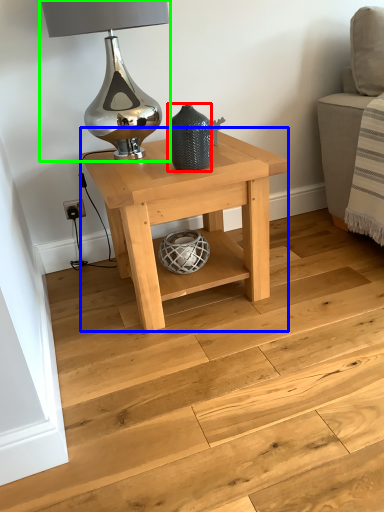
Question: Considering the real-world distances, which object is farthest from vase (highlighted by a red box)? table (highlighted by a blue box) or table lamp (highlighted by a green box)?

Choices:
 (A) table
 (B) table lamp

Answer: (B)